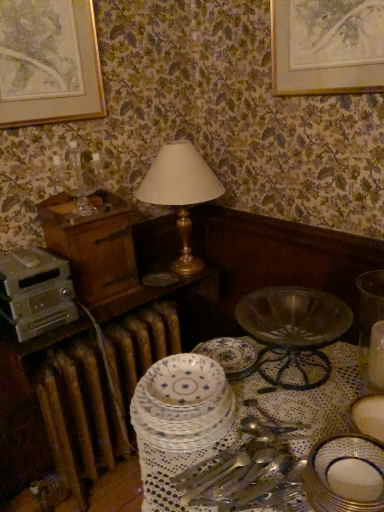
Measure the distance between metallic silver appliance at left and camera.

The distance of metallic silver appliance at left from camera is 1.29 meters.

Identify the location of porcelain bowl at center. [255, 413].

What do you see at coordinates (180, 192) in the screenshot? I see `gold metallic table lamp at center` at bounding box center [180, 192].

Find the location of `porcelain plate at lower right, which is the 3th plate in back-to-front order`. porcelain plate at lower right, which is the 3th plate in back-to-front order is located at coordinates (346, 475).

In terms of height, does blue floral plate at center, placed as the 2th plate when sorted from right to left, look taller or shorter compared to porcelain plate at center, which appears as the 3th plate when viewed from the right?

blue floral plate at center, placed as the 2th plate when sorted from right to left, is shorter than porcelain plate at center, which appears as the 3th plate when viewed from the right.

Between point (226, 364) and point (204, 400), which one is positioned in front?

Point (204, 400)

In the scene shown: Which object is further away from the camera taking this photo, blue floral plate at center, which is the third plate in front-to-back order, or porcelain plate at center, the 1th plate positioned from the left?

Positioned behind is blue floral plate at center, which is the third plate in front-to-back order.

Is there a large distance between blue floral plate at center, which ranks as the first plate in back-to-front order, and porcelain plate at center, arranged as the second plate when viewed from the back?

No, blue floral plate at center, which ranks as the first plate in back-to-front order, is not far from porcelain plate at center, arranged as the second plate when viewed from the back.

Which of these two, porcelain plate at lower right, the first plate in the right-to-left sequence, or gold-framed artwork at upper left, is thinner?

gold-framed artwork at upper left is thinner.

Could you tell me if porcelain plate at lower right, the first plate in the right-to-left sequence, is facing gold-framed artwork at upper left?

No, porcelain plate at lower right, the first plate in the right-to-left sequence, is not turned towards gold-framed artwork at upper left.

Is porcelain plate at lower right, the first plate in the right-to-left sequence, positioned behind gold-framed artwork at upper left?

That is False.

Considering the positions of point (340, 495) and point (93, 75), is point (340, 495) closer or farther from the camera than point (93, 75)?

Point (340, 495) appears to be closer to the viewer than point (93, 75).

Is point (363, 377) positioned in front of point (130, 319)?

Yes, point (363, 377) is in front of point (130, 319).

Is translucent glass bowl at lower right in contact with brown metallic radiator at lower left?

No, translucent glass bowl at lower right is not in contact with brown metallic radiator at lower left.

Does translucent glass bowl at lower right turn towards brown metallic radiator at lower left?

No, translucent glass bowl at lower right is not turned towards brown metallic radiator at lower left.

Is gold-framed artwork at upper left looking in the opposite direction of clear glass candle holder at upper left?

gold-framed artwork at upper left is not turned away from clear glass candle holder at upper left.

Is the depth of gold-framed artwork at upper left less than that of clear glass candle holder at upper left?

Yes, it is in front of clear glass candle holder at upper left.

Is gold-framed artwork at upper left directly adjacent to clear glass candle holder at upper left?

They are not placed beside each other.

Considering the relative positions of gold-framed artwork at upper left and clear glass candle holder at upper left in the image provided, is gold-framed artwork at upper left to the right of clear glass candle holder at upper left from the viewer's perspective?

No, gold-framed artwork at upper left is not to the right of clear glass candle holder at upper left.

How many degrees apart are the facing directions of porcelain bowl at center and metallic silver appliance at left?

89.9 degrees.

Is metallic silver appliance at left completely or partially inside porcelain bowl at center?

No, metallic silver appliance at left is not a part of porcelain bowl at center.

From a real-world perspective, is porcelain bowl at center physically below metallic silver appliance at left?

Yes, from a real-world perspective, porcelain bowl at center is under metallic silver appliance at left.

Visually, is porcelain bowl at center positioned to the left or to the right of metallic silver appliance at left?

From the image, it's evident that porcelain bowl at center is to the right of metallic silver appliance at left.

In terms of size, does metallic silver appliance at left appear bigger or smaller than blue floral plate at center, which is the third plate in front-to-back order?

In the image, metallic silver appliance at left appears to be larger than blue floral plate at center, which is the third plate in front-to-back order.

From the metallic silver appliance at left, count 1st plates forward and point to it. Please provide its 2D coordinates.

[(230, 355)]

Is metallic silver appliance at left at the right side of blue floral plate at center, placed as the 2th plate when sorted from right to left?

No.

Is point (154, 432) positioned before point (159, 196)?

That is True.

From a real-world perspective, relative to gold metallic table lamp at center, is porcelain plate at center, the 1th plate positioned from the left, vertically above or below?

Clearly, from a real-world perspective, porcelain plate at center, the 1th plate positioned from the left, is below gold metallic table lamp at center.

Between porcelain plate at center, the 1th plate positioned from the left, and gold metallic table lamp at center, which one has larger width?

With larger width is gold metallic table lamp at center.

Where is `the 1st plate to the right of the porcelain plate at center, arranged as the second plate when viewed from the back, counting from the anchor's position`? This screenshot has width=384, height=512. the 1st plate to the right of the porcelain plate at center, arranged as the second plate when viewed from the back, counting from the anchor's position is located at coordinates (230, 355).

Find the location of `plate that is the 1st one below the gold-framed artwork at upper left (from a real-world perspective)`. plate that is the 1st one below the gold-framed artwork at upper left (from a real-world perspective) is located at coordinates (346, 475).

Based on their spatial positions, is metallic silver appliance at left or gold metallic table lamp at center closer to clear glass candle holder at upper left?

The object closer to clear glass candle holder at upper left is gold metallic table lamp at center.

When comparing their distances from clear glass candle holder at upper left, does brown metallic radiator at lower left or metallic silver appliance at left seem further?

Among the two, brown metallic radiator at lower left is located further to clear glass candle holder at upper left.

Based on their spatial positions, is translucent glass bowl at lower right or blue floral plate at center, which ranks as the first plate in back-to-front order, closer to porcelain bowl at center?

blue floral plate at center, which ranks as the first plate in back-to-front order, is closer to porcelain bowl at center.

Which object lies further to the anchor point translucent glass bowl at lower right, blue floral plate at center, placed as the 2th plate when sorted from right to left, or brown metallic radiator at lower left?

brown metallic radiator at lower left.

Considering their positions, is blue floral plate at center, which ranks as the first plate in back-to-front order, positioned further to brown metallic radiator at lower left than gold metallic table lamp at center?

gold metallic table lamp at center.

When comparing their distances from clear glass candle holder at upper left, does blue floral plate at center, positioned as the second plate in left-to-right order, or porcelain plate at center, the 1th plate positioned from the left, seem further?

Among the two, porcelain plate at center, the 1th plate positioned from the left, is located further to clear glass candle holder at upper left.

When comparing their distances from porcelain bowl at center, does blue floral plate at center, positioned as the second plate in left-to-right order, or gold metallic table lamp at center seem further?

gold metallic table lamp at center is further to porcelain bowl at center.

From the image, which object appears to be nearer to clear glass candle holder at upper left, brown metallic radiator at lower left or porcelain plate at lower right, which is counted as the third plate, starting from the left?

brown metallic radiator at lower left lies closer to clear glass candle holder at upper left than the other object.

Image resolution: width=384 pixels, height=512 pixels. What are the coordinates of `candle holder between gold-framed artwork at upper left and gold metallic table lamp at center in the up-down direction` in the screenshot? It's located at pos(79,176).

Locate an element on the screen. The image size is (384, 512). candle holder that lies between gold-framed artwork at upper left and porcelain bowl at center from top to bottom is located at coordinates (79, 176).

Locate an element on the screen. This screenshot has width=384, height=512. plate between clear glass candle holder at upper left and porcelain plate at center, arranged as the second plate when viewed from the back, in the vertical direction is located at coordinates (230, 355).

Find the location of a particular element. This screenshot has width=384, height=512. radiator between gold metallic table lamp at center and porcelain bowl at center from top to bottom is located at coordinates (100, 391).